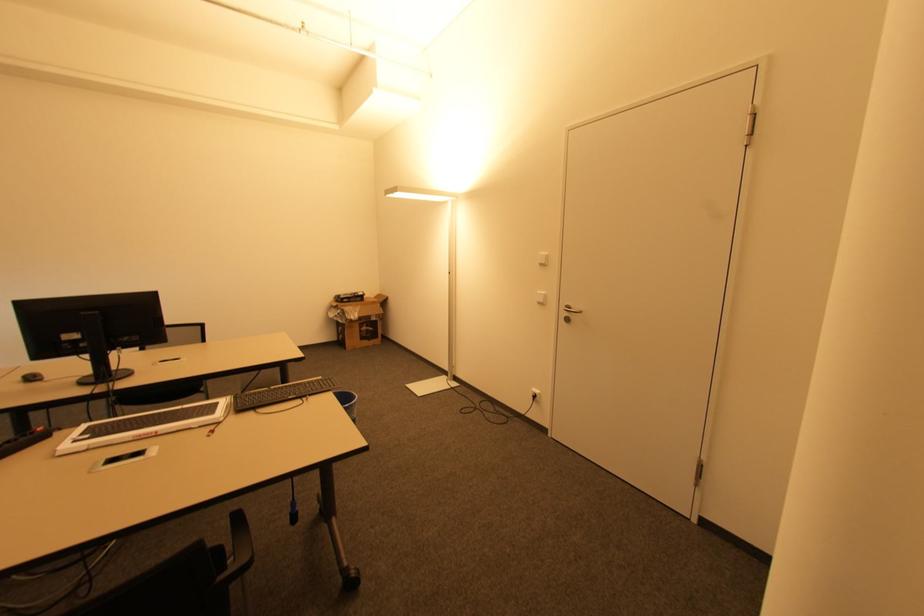
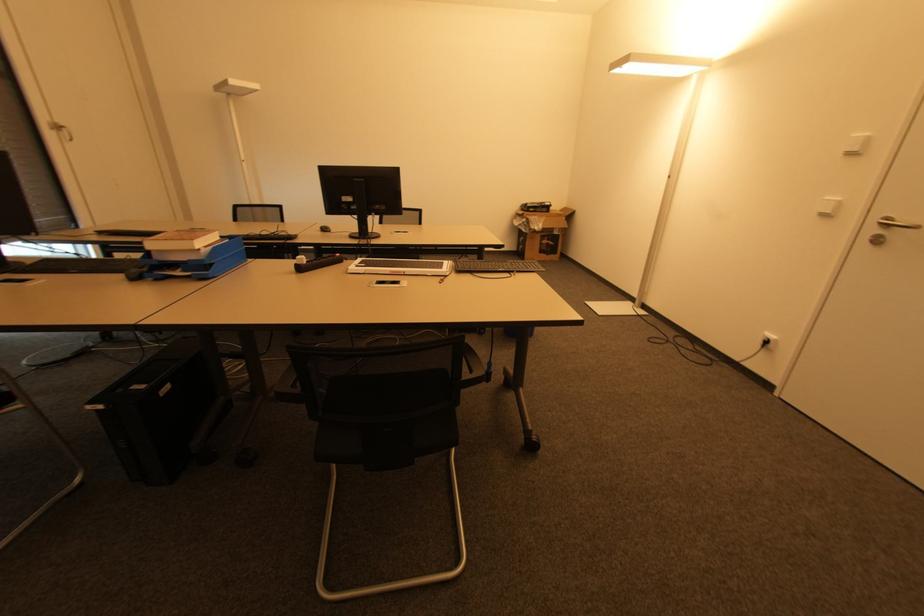
The point at (542, 301) is marked in the first image. Where is the corresponding point in the second image?

(832, 214)